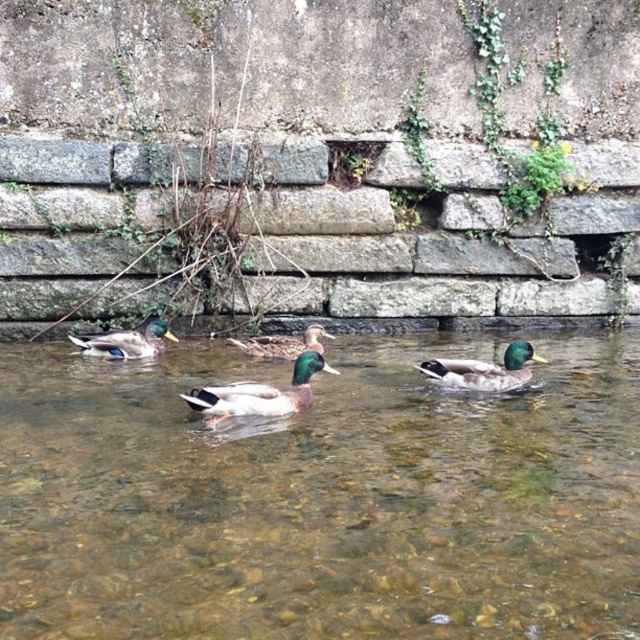
Between green glossy duck at right and green glossy duck at center, which one is positioned lower?

Positioned lower is green glossy duck at right.

Is point (429, 360) positioned behind point (250, 339)?

Yes, it is.

Identify the location of green glossy duck at right. The image size is (640, 640). (484, 369).

Who is positioned more to the left, clear water at center or green glossy duck at left?

green glossy duck at left is more to the left.

Between point (150, 605) and point (154, 332), which one is positioned behind?

The point (154, 332) is behind.

Where is `clear water at center`? clear water at center is located at coordinates (321, 499).

Does clear water at center have a lesser height compared to green matte duck at center?

Indeed, clear water at center has a lesser height compared to green matte duck at center.

Is clear water at center to the right of green matte duck at center from the viewer's perspective?

Correct, you'll find clear water at center to the right of green matte duck at center.

You are a GUI agent. You are given a task and a screenshot of the screen. Output one action in this format:
    pyautogui.click(x=<x>, y=<y>)
    Task: Click on the clear water at center
    The image size is (640, 640).
    Given the screenshot: What is the action you would take?
    pyautogui.click(x=321, y=499)

Where is `clear water at center`? The image size is (640, 640). clear water at center is located at coordinates (321, 499).